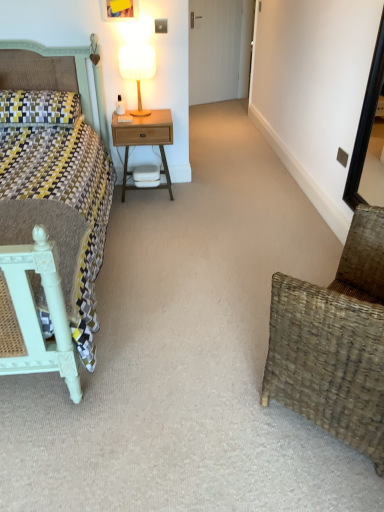
Locate an element on the screen. This screenshot has height=512, width=384. vacant space to the right of woodenmaterial/texturenightstand at center is located at coordinates (199, 192).